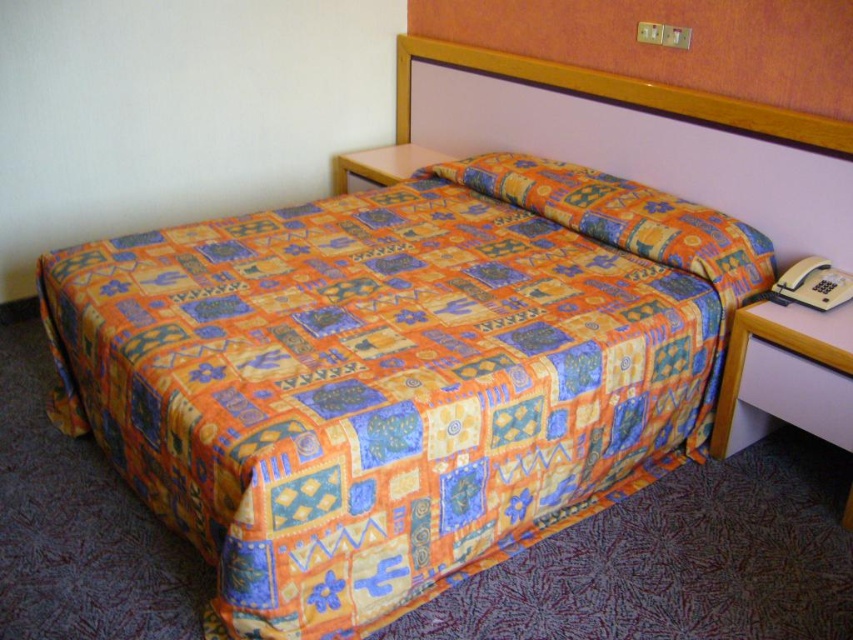
Can you confirm if printed fabric quilt at center is bigger than orange printed fabric pillow at center?

Correct, printed fabric quilt at center is larger in size than orange printed fabric pillow at center.

Who is taller, printed fabric quilt at center or orange printed fabric pillow at center?

printed fabric quilt at center

I want to click on printed fabric quilt at center, so click(x=374, y=388).